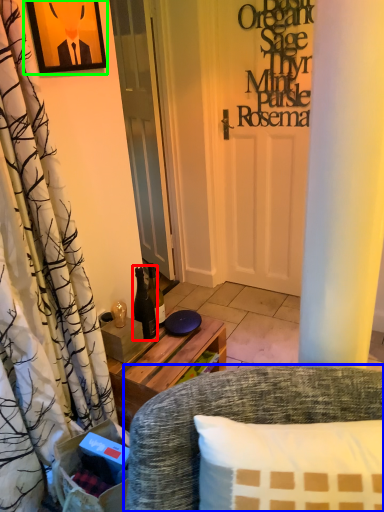
Question: Estimate the real-world distances between objects in this image. Which object is farther from bottle (highlighted by a red box), chair (highlighted by a blue box) or picture frame (highlighted by a green box)?

Choices:
 (A) chair
 (B) picture frame

Answer: (B)